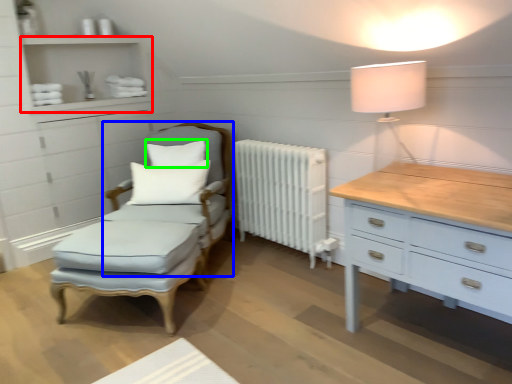
Question: Which object is the closest to the shelf (highlighted by a red box)? Choose among these: swivel chair (highlighted by a blue box) or pillow (highlighted by a green box).

Choices:
 (A) swivel chair
 (B) pillow

Answer: (B)